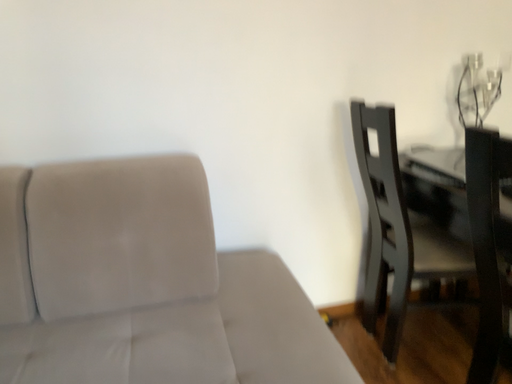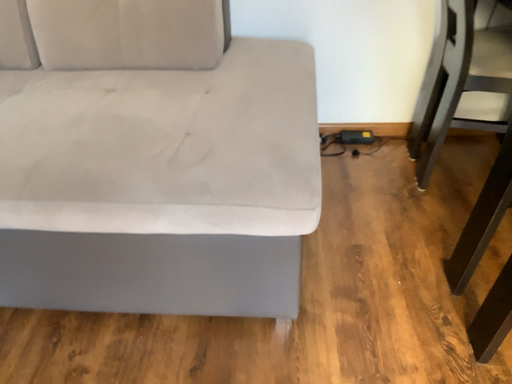
Question: Which way did the camera rotate in the video?

Choices:
 (A) rotated downward
 (B) rotated upward

Answer: (A)